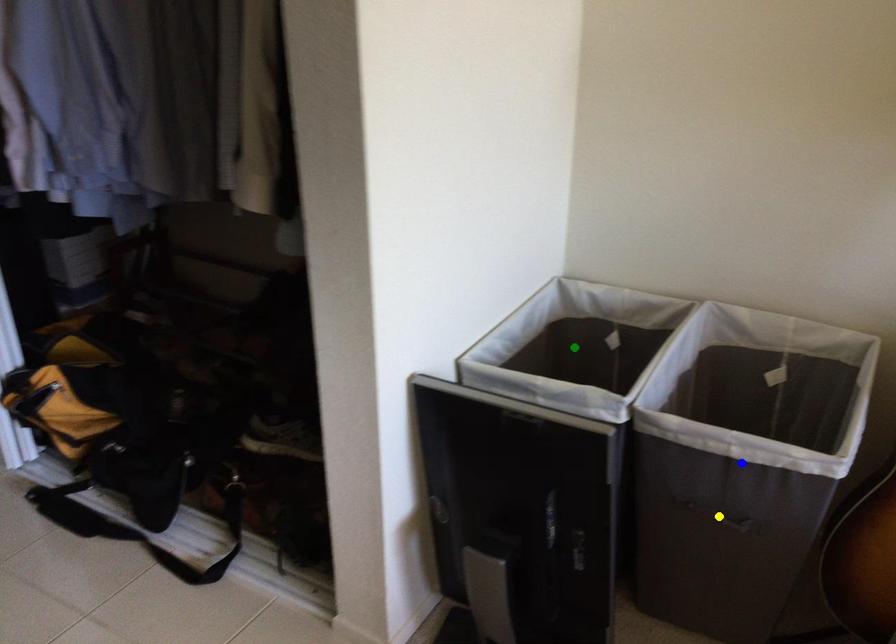
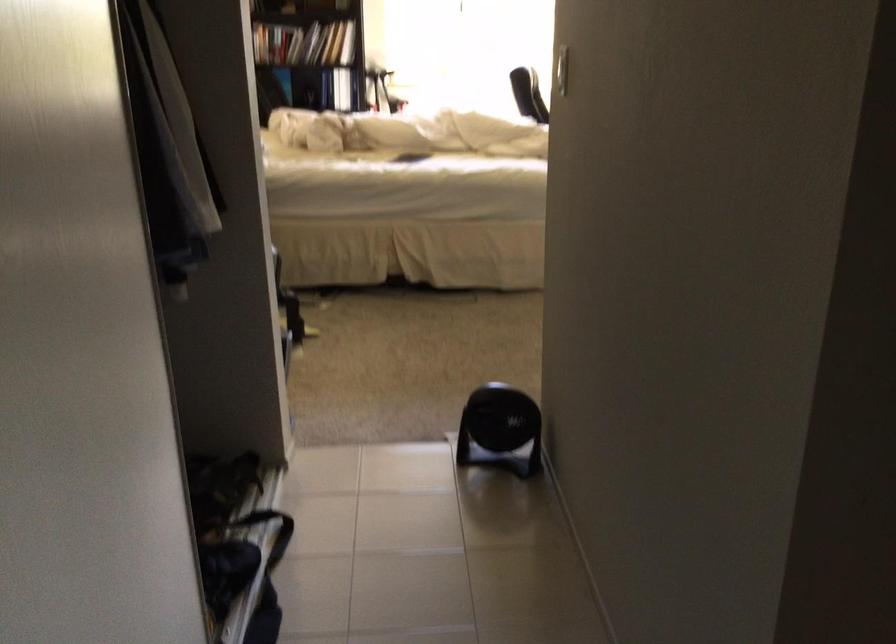
I am providing you with two images of the same scene from different viewpoints. Three points are marked in image1. Which point corresponds to a part or object that is occluded in image2?In image1, three points are marked. Which of them correspond to a part or object that is occluded in image2?Among the three points shown in image1, which one corresponds to a part or object that is no longer visible due to occlusion in image2?

yellow point, blue point, green point cannot be seen in image2.